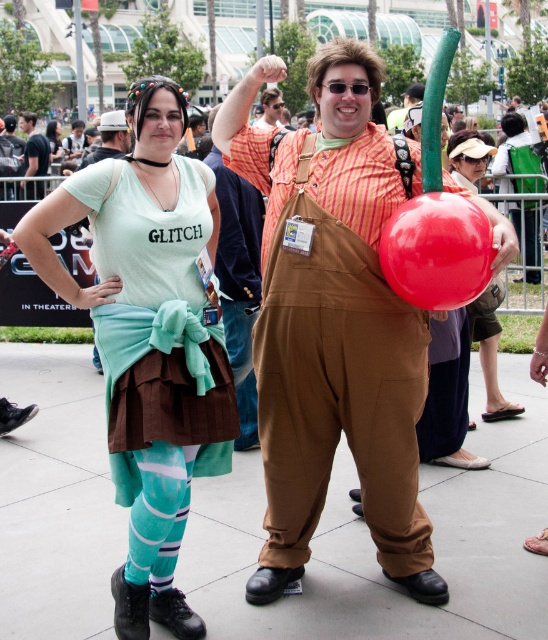
Question: Does matte green t-shirt at center appear over orange cotton shirt at center?

Choices:
 (A) no
 (B) yes

Answer: (A)

Question: Is orange cotton shirt at center positioned before matte green dress at center?

Choices:
 (A) no
 (B) yes

Answer: (B)

Question: Which is nearer to the matte black laptop at left?

Choices:
 (A) red rubber balloon at center
 (B) matte red balloon at right
 (C) black t-shirt at left
 (D) green fabric balloon at upper center

Answer: (C)

Question: Which point is closer to the camera?

Choices:
 (A) matte red balloon at right
 (B) green fabric balloon at upper center
 (C) black t-shirt at left

Answer: (A)

Question: Which point is farther to the camera?

Choices:
 (A) orange cotton shirt at center
 (B) black t-shirt at left
 (C) red rubber balloon at center

Answer: (B)

Question: Does matte green t-shirt at center have a smaller size compared to orange cotton shirt at center?

Choices:
 (A) no
 (B) yes

Answer: (A)